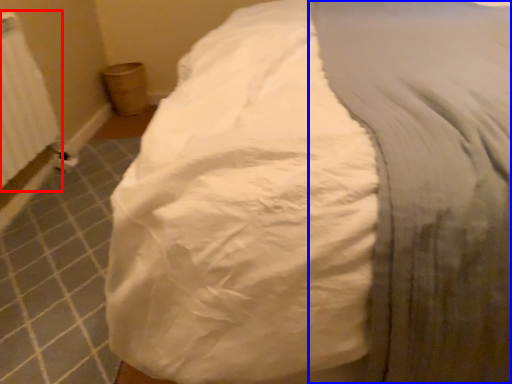
Question: Which of the following is the closest to the observer, radiator (highlighted by a red box) or sheet (highlighted by a blue box)?

Choices:
 (A) radiator
 (B) sheet

Answer: (B)